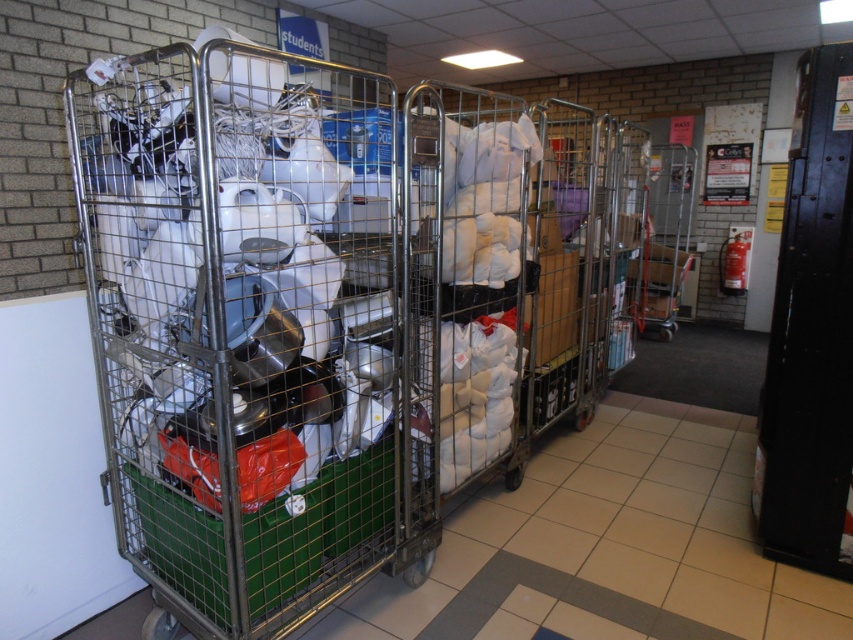
You are standing in the storage area and need to locate two specific points marked on the floor. The first point is at coordinates point (387, 180) and the second is at point (689, 262). Which point is closer to your current position?

Point (387, 180) is closer to the camera than point (689, 262), so the first point is closer to your current position.

You are a maintenance worker needing to choose between the metallic silver trolley at left and the metallic silver trolley at center to carry a large box that requires extra space. Which trolley should you choose?

The metallic silver trolley at left has a larger width than the metallic silver trolley at center, so you should choose the metallic silver trolley at left to carry the large box that requires extra space.

You are standing in the storage area and need to locate the metallic silver trolley at left. Based on the coordinates provided, where should you look in the image?

The metallic silver trolley at left is located at coordinates point (242, 324) in the image.